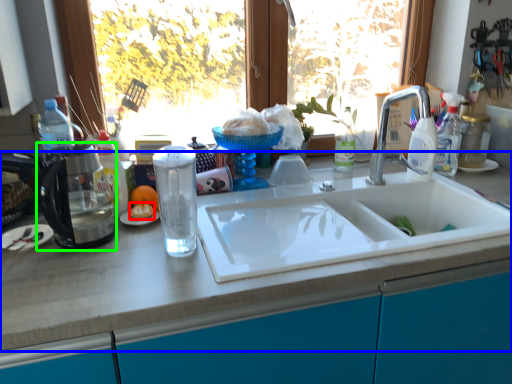
Question: Which object is positioned farthest from food (highlighted by a red box)? Select from countertop (highlighted by a blue box) and appliance (highlighted by a green box).

Choices:
 (A) countertop
 (B) appliance

Answer: (A)